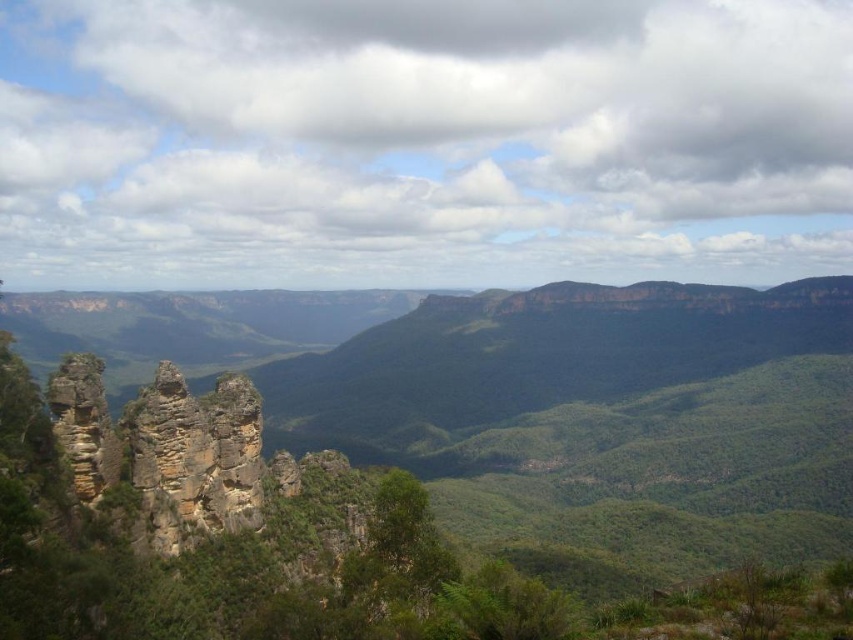
You are standing at the base of the Three Sisters rock pillars and notice two points marked in the scene. The first point is at coordinates point (270, 436) and the second is at point (222, 397). Which of these two points is closer to your current position?

Point (222, 397) is closer to your current position because it is less further to the camera than point (270, 436).

You are an airplane passenger looking out the window and see the white fluffy cloud at upper center and the rugged rock formation at center. Which object is higher in the sky?

The white fluffy cloud at upper center is higher in the sky than the rugged rock formation at center because it is located above it.

You are planning to set up a campsite and need to choose between two rugged rock formations for shelter. The rugged rock formation at center and the rugged stone rock formation at left. Which one has a larger width?

The rugged rock formation at center might be wider than rugged stone rock formation at left according to the description.